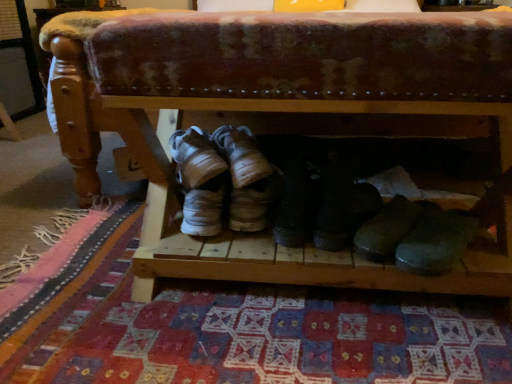
Question: Considering the positions of point (91, 196) and point (328, 208), is point (91, 196) closer or farther from the camera than point (328, 208)?

Choices:
 (A) farther
 (B) closer

Answer: (A)

Question: Considering the positions of wooden shoe rack at center and black leather boot at center, marked as the 1th footwear in a right-to-left arrangement, in the image, is wooden shoe rack at center taller or shorter than black leather boot at center, marked as the 1th footwear in a right-to-left arrangement,?

Choices:
 (A) short
 (B) tall

Answer: (B)

Question: Based on their relative distances, which object is nearer to the white suede sneakers at center, positioned as the 3th footwear in right-to-left order?

Choices:
 (A) patterned carpet at lower center
 (B) wooden shoe rack at center
 (C) black leather boot at center, marked as the 1th footwear in a right-to-left arrangement
 (D) black leather boots at center, the second footwear when ordered from right to left

Answer: (D)

Question: Estimate the real-world distances between objects in this image. Which object is farther from the patterned carpet at lower center?

Choices:
 (A) wooden shoe rack at center
 (B) black leather boots at center, the second footwear when ordered from right to left
 (C) black leather boot at center, arranged as the 3th footwear when viewed from the left
 (D) white suede sneakers at center, which is counted as the 1th footwear, starting from the left

Answer: (D)